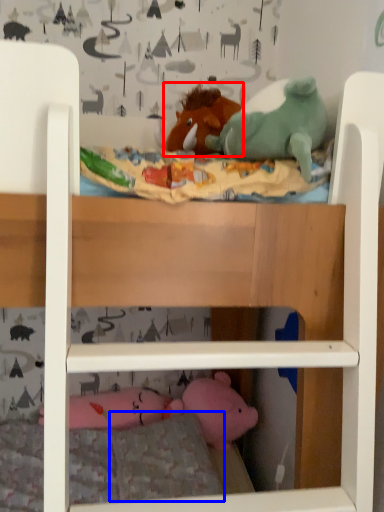
Question: Which point is closer to the camera, toy (highlighted by a red box) or pillow (highlighted by a blue box)?

Choices:
 (A) toy
 (B) pillow

Answer: (B)